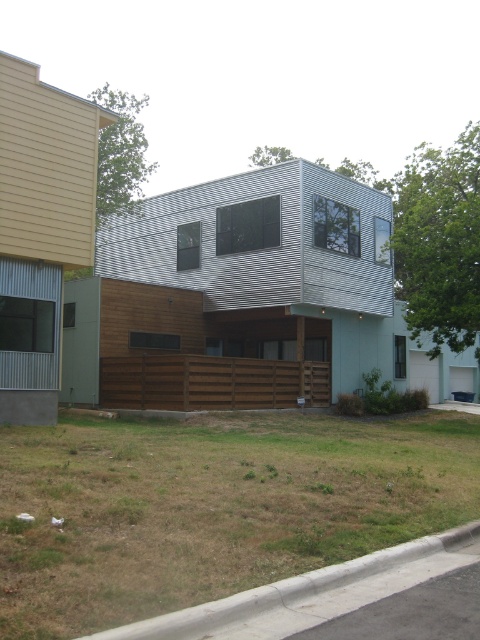
You are a landscape architect planning to replace the brown dry grass at lower center and the gray concrete curb at lower right with new materials. Which object requires more material due to its size?

The brown dry grass at lower center requires more material because it has a larger size compared to the gray concrete curb at lower right.